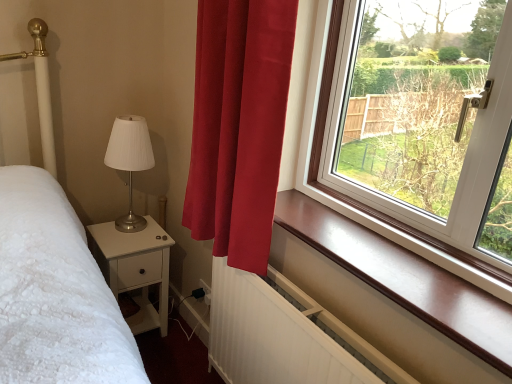
Where is `empty space that is ontop of white matte nightstand at lower left (from a real-world perspective)`? empty space that is ontop of white matte nightstand at lower left (from a real-world perspective) is located at coordinates (125, 231).